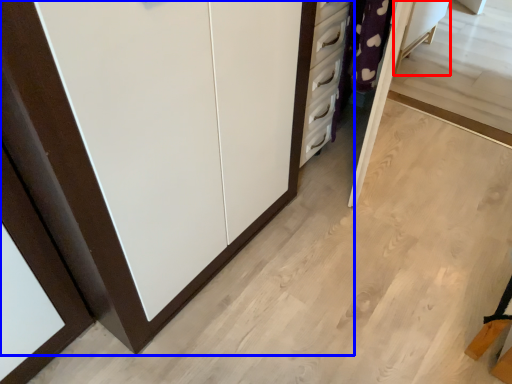
Question: Which point is further to the camera, vanity (highlighted by a red box) or cupboard (highlighted by a blue box)?

Choices:
 (A) vanity
 (B) cupboard

Answer: (A)